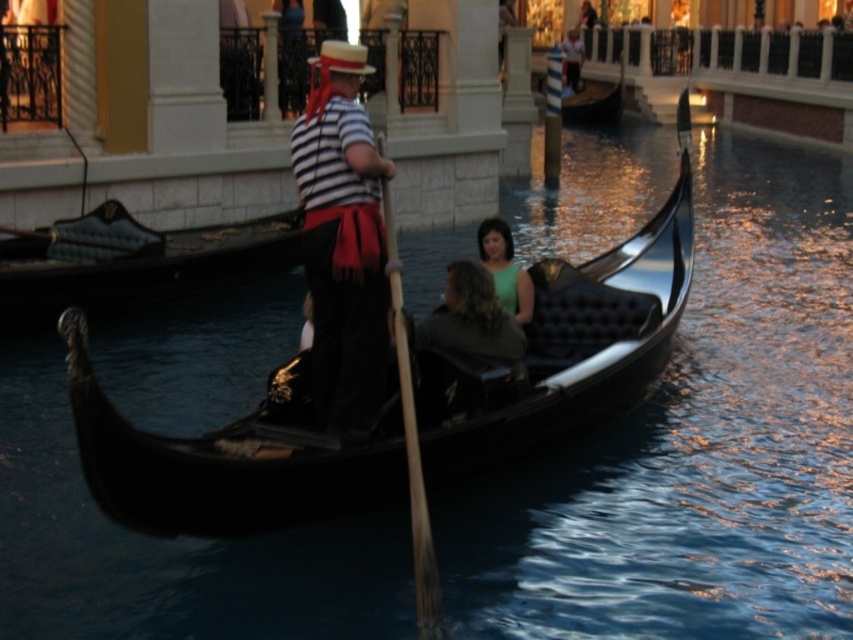
You are standing on the dock and want to board the shiny black gondola at center. Based on its position, which direction should you walk to reach it?

The shiny black gondola at center is located at coordinates 0.541 on the x axis and 0.665 on the y axis. Since the gondola is positioned at the center of the image, you should walk straight ahead towards the middle of the canal to reach it.

You are a tourist in Venice and want to take a photo of the black polished wood gondola at center and the black glossy gondola at center. Which one is closer to you?

The black polished wood gondola at center is closer to you because it is positioned in front of the black glossy gondola at center.